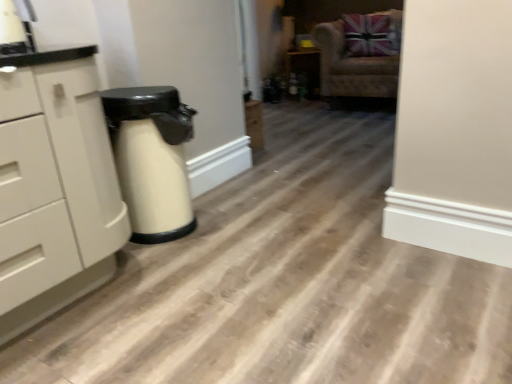
This screenshot has width=512, height=384. What do you see at coordinates (58, 184) in the screenshot?
I see `white matte chest of drawers at left` at bounding box center [58, 184].

Where is `matte black cabinet at center`? This screenshot has width=512, height=384. matte black cabinet at center is located at coordinates (303, 72).

Image resolution: width=512 pixels, height=384 pixels. Identify the location of velvet beige armchair at upper right. (352, 67).

Is white matte chest of drawers at left inside velvet beige armchair at upper right?

No, white matte chest of drawers at left is not surrounded by velvet beige armchair at upper right.

Can you confirm if velvet beige armchair at upper right is positioned to the left of white matte chest of drawers at left?

Incorrect, velvet beige armchair at upper right is not on the left side of white matte chest of drawers at left.

How different are the orientations of velvet beige armchair at upper right and white matte chest of drawers at left in degrees?

They differ by 85.1 degrees in their facing directions.

Looking at this image, is velvet beige armchair at upper right not within matte black cabinet at center?

That's correct, velvet beige armchair at upper right is outside of matte black cabinet at center.

Can you confirm if velvet beige armchair at upper right is wider than matte black cabinet at center?

Indeed, velvet beige armchair at upper right has a greater width compared to matte black cabinet at center.

How far apart are velvet beige armchair at upper right and matte black cabinet at center?

velvet beige armchair at upper right and matte black cabinet at center are 20.59 inches apart from each other.

Can you confirm if velvet beige armchair at upper right is positioned to the left of matte black cabinet at center?

No, velvet beige armchair at upper right is not to the left of matte black cabinet at center.

Which point is more forward, [65,128] or [386,77]?

The point [65,128] is closer to the camera.

Is white matte chest of drawers at left further to camera compared to velvet beige armchair at upper right?

No.

Which is more to the right, white matte chest of drawers at left or velvet beige armchair at upper right?

velvet beige armchair at upper right is more to the right.

How much distance is there between white matte chest of drawers at left and velvet beige armchair at upper right?

white matte chest of drawers at left is 10.37 feet from velvet beige armchair at upper right.

How many degrees apart are the facing directions of matte black cabinet at center and velvet beige armchair at upper right?

The angular difference between matte black cabinet at center and velvet beige armchair at upper right is 34.9 degrees.

You are a GUI agent. You are given a task and a screenshot of the screen. Output one action in this format:
    pyautogui.click(x=<x>, y=<y>)
    Task: Click on the chair below the matte black cabinet at center (from the image's perspective)
    The image size is (512, 384).
    Given the screenshot: What is the action you would take?
    pyautogui.click(x=352, y=67)

From a real-world perspective, between matte black cabinet at center and velvet beige armchair at upper right, who is vertically higher?

velvet beige armchair at upper right, from a real-world perspective.

Considering the points (315, 55) and (323, 25), which point is in front, point (315, 55) or point (323, 25)?

The point (323, 25) is in front.

From a real-world perspective, which is physically above, matte black cabinet at center or white matte chest of drawers at left?

white matte chest of drawers at left is physically above.

Between matte black cabinet at center and white matte chest of drawers at left, which one is positioned behind?

matte black cabinet at center is more distant.

Which point is more forward, (316, 58) or (24, 251)?

The point (24, 251) is closer to the camera.

Which object is positioned more to the right, white matte chest of drawers at left or matte black cabinet at center?

matte black cabinet at center.

In the scene shown: Is white matte chest of drawers at left oriented towards matte black cabinet at center?

No, white matte chest of drawers at left is not turned towards matte black cabinet at center.

From the image's perspective, who appears lower, white matte chest of drawers at left or matte black cabinet at center?

white matte chest of drawers at left appears lower in the image.

From the picture: Is white matte chest of drawers at left smaller than matte black cabinet at center?

Incorrect, white matte chest of drawers at left is not smaller in size than matte black cabinet at center.

This screenshot has height=384, width=512. What are the coordinates of `the chest of drawers located in front of the velvet beige armchair at upper right` in the screenshot? It's located at (58, 184).

Find the location of `cabinetry on the left of velvet beige armchair at upper right`. cabinetry on the left of velvet beige armchair at upper right is located at coordinates (303, 72).

When comparing their distances from velvet beige armchair at upper right, does white matte chest of drawers at left or matte black cabinet at center seem further?

white matte chest of drawers at left lies further to velvet beige armchair at upper right than the other object.

Considering their positions, is velvet beige armchair at upper right positioned closer to matte black cabinet at center than white matte chest of drawers at left?

Based on the image, velvet beige armchair at upper right appears to be nearer to matte black cabinet at center.

From the image, which object appears to be farther from matte black cabinet at center, white matte chest of drawers at left or velvet beige armchair at upper right?

white matte chest of drawers at left is further to matte black cabinet at center.

Looking at the image, which one is located closer to white matte chest of drawers at left, velvet beige armchair at upper right or matte black cabinet at center?

velvet beige armchair at upper right is positioned closer to the anchor white matte chest of drawers at left.

When comparing their distances from velvet beige armchair at upper right, does matte black cabinet at center or white matte chest of drawers at left seem closer?

matte black cabinet at center lies closer to velvet beige armchair at upper right than the other object.

Estimate the real-world distances between objects in this image. Which object is closer to white matte chest of drawers at left, matte black cabinet at center or velvet beige armchair at upper right?

velvet beige armchair at upper right is positioned closer to the anchor white matte chest of drawers at left.

Locate an element on the screen. This screenshot has width=512, height=384. chair between white matte chest of drawers at left and matte black cabinet at center along the z-axis is located at coordinates (352, 67).